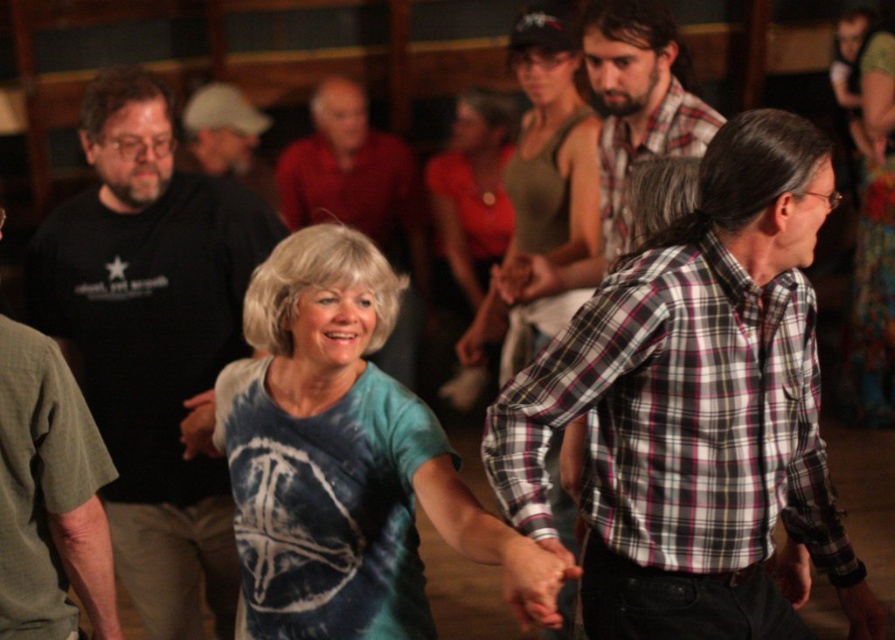
Question: Which of the following is the farthest from the observer?

Choices:
 (A) (26, 499)
 (B) (425, 184)
 (C) (294, 576)

Answer: (B)

Question: Does matte black shirt at center have a larger size compared to plaid cotton shirt at upper center?

Choices:
 (A) yes
 (B) no

Answer: (A)

Question: Which object is farther from the camera taking this photo?

Choices:
 (A) tie-dye fabric shirt at center
 (B) dark green t-shirt at left
 (C) black t-shirt at left

Answer: (C)

Question: From the image, what is the correct spatial relationship of matte red shirt at center in relation to matte black shirt at upper center?

Choices:
 (A) left
 (B) right

Answer: (B)

Question: Which is nearer to the tie-dye fabric shirt at center?

Choices:
 (A) black t-shirt at left
 (B) plaid cotton shirt at upper center

Answer: (A)

Question: Does plaid shirt at right have a greater width compared to black t-shirt at left?

Choices:
 (A) yes
 (B) no

Answer: (A)